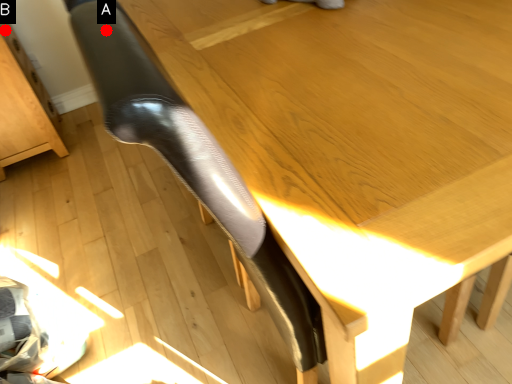
Question: Two points are circled on the image, labeled by A and B beside each circle. Among these points, which one is nearest to the camera?

Choices:
 (A) A is closer
 (B) B is closer

Answer: (A)